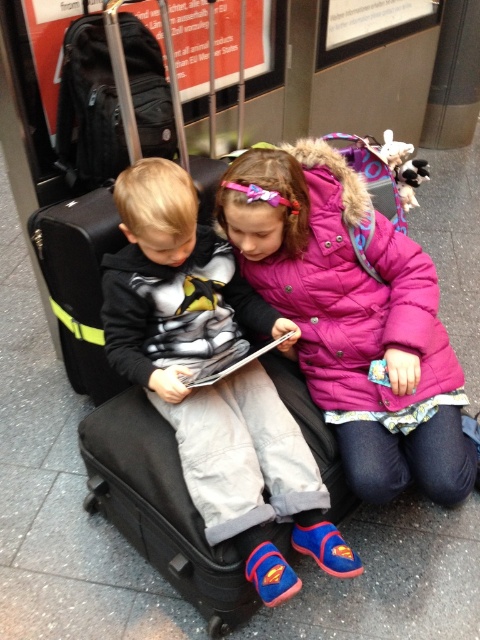
Is puffy pink coat at center in front of matte black suitcase at center?

No, it is not.

Is point (352, 397) more distant than point (183, 326)?

Yes.

The image size is (480, 640). What are the coordinates of `puffy pink coat at center` in the screenshot? It's located at (354, 316).